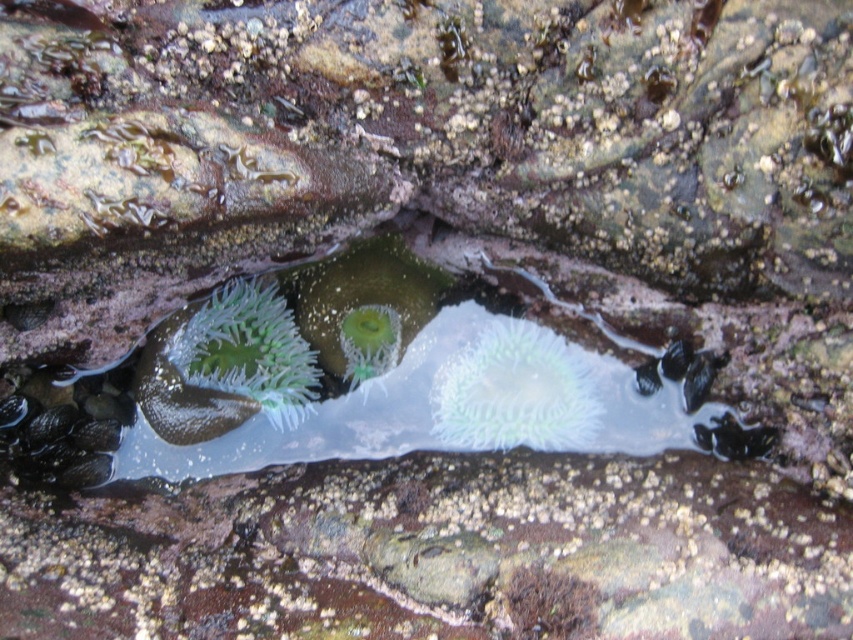
You are a marine biologist observing the tide pool. You need to collect samples from both the translucent gelatinous anemone at center and the green translucent anemone at center. Given that your collection tool has a maximum reach of 8 inches, can you collect both anemones without moving closer?

The distance between the translucent gelatinous anemone at center and the green translucent anemone at center is 9.07 inches, which exceeds the 8 inch reach of your tool. Therefore, you cannot collect both anemones without moving closer.